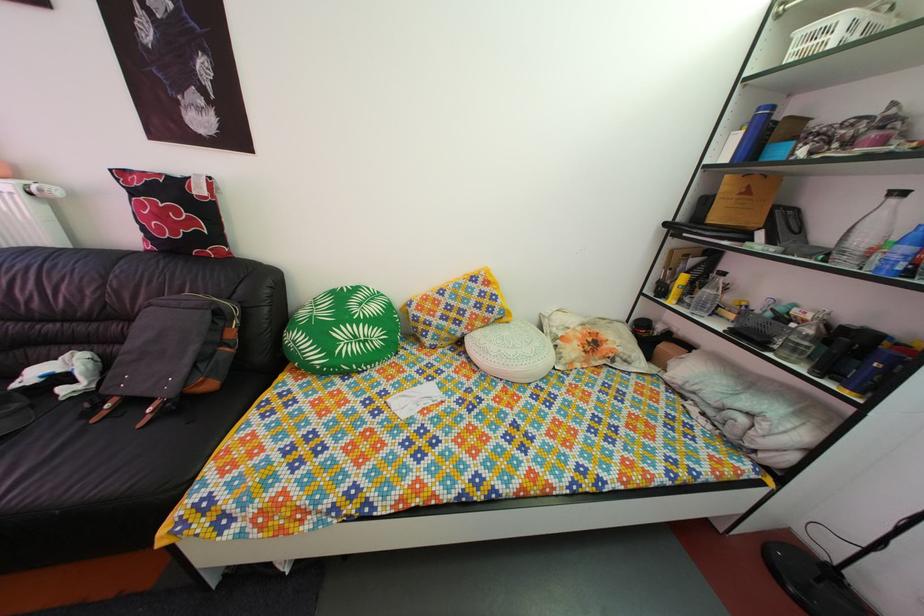
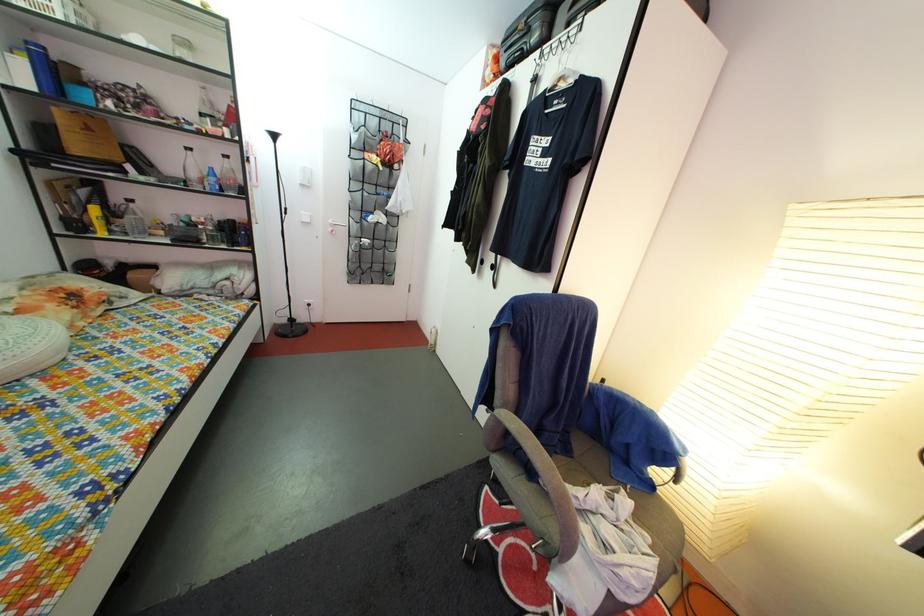
Locate, in the second image, the point that corresponds to pixel 736 185 in the first image.

(64, 118)